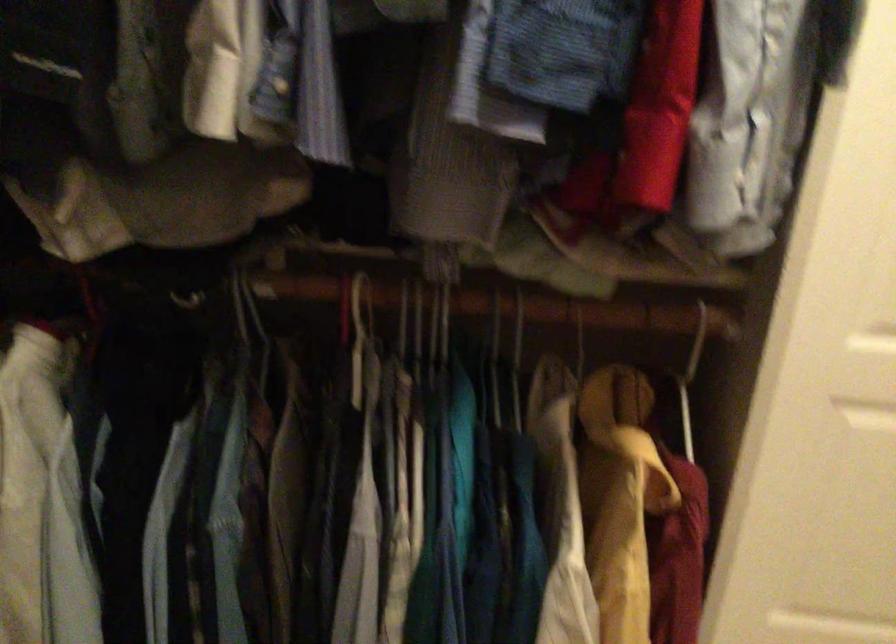
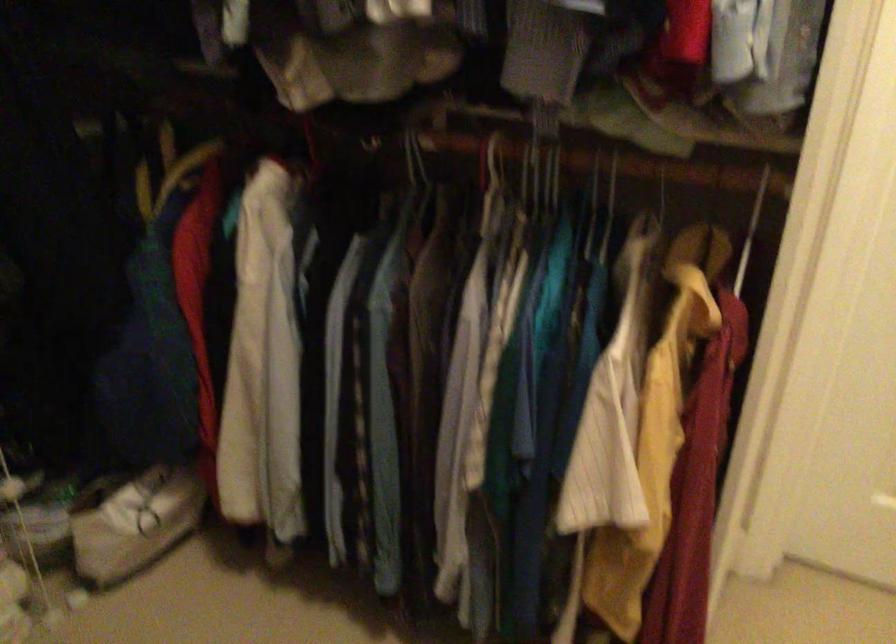
Where in the second image is the point corresponding to [442,325] from the first image?

(554, 176)